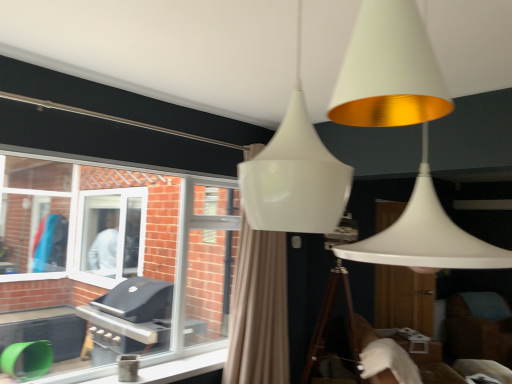
Question: Is clear glass window at left a part of beige fabric curtain at center?

Choices:
 (A) yes
 (B) no

Answer: (B)

Question: From the image's perspective, is beige fabric curtain at center on clear glass window at left?

Choices:
 (A) yes
 (B) no

Answer: (B)

Question: Is beige fabric curtain at center bigger than clear glass window at left?

Choices:
 (A) no
 (B) yes

Answer: (B)

Question: Is beige fabric curtain at center thinner than clear glass window at left?

Choices:
 (A) no
 (B) yes

Answer: (A)

Question: From a real-world perspective, does beige fabric curtain at center stand above clear glass window at left?

Choices:
 (A) yes
 (B) no

Answer: (B)

Question: Does beige fabric curtain at center have a lesser height compared to clear glass window at left?

Choices:
 (A) no
 (B) yes

Answer: (A)

Question: Is there a large distance between clear glass window at left and brown fabric swivel chair at lower right?

Choices:
 (A) no
 (B) yes

Answer: (B)

Question: Is clear glass window at left at the right side of brown fabric swivel chair at lower right?

Choices:
 (A) yes
 (B) no

Answer: (B)

Question: Can you confirm if clear glass window at left is shorter than brown fabric swivel chair at lower right?

Choices:
 (A) yes
 (B) no

Answer: (B)

Question: Is clear glass window at left wider than brown fabric swivel chair at lower right?

Choices:
 (A) yes
 (B) no

Answer: (B)

Question: From the image's perspective, is clear glass window at left under brown fabric swivel chair at lower right?

Choices:
 (A) yes
 (B) no

Answer: (B)

Question: Is clear glass window at left looking in the opposite direction of brown fabric swivel chair at lower right?

Choices:
 (A) no
 (B) yes

Answer: (A)

Question: Is clear glass window at left at the left side of beige fabric curtain at center?

Choices:
 (A) yes
 (B) no

Answer: (A)